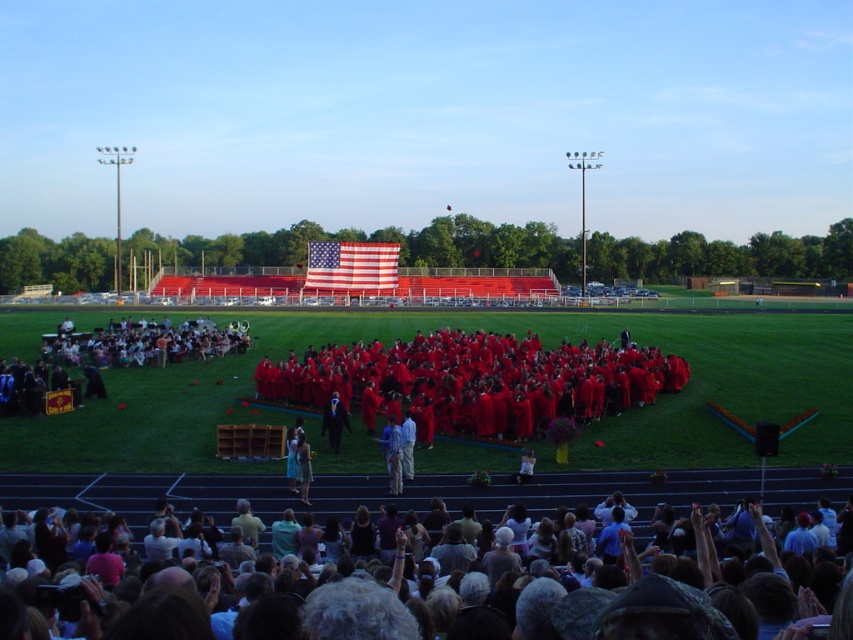
From the picture: You are a photographer trying to capture a clear photo of both the red matte graduation gowns at center and the dark blue suit at center. Which object should you focus on first to ensure it appears sharp in the photo?

The red matte graduation gowns at center is much taller than the dark blue suit at center, so you should focus on the red matte graduation gowns at center first to ensure it appears sharp in the photo.

You are a photographer at the graduation ceremony. You want to take a photo that includes both the matte red graduation gowns at lower center and the dark blue suit at center. Given their sizes, which object should you focus on to ensure both are in frame without zooming in or out?

The matte red graduation gowns at lower center are larger in size compared to the dark blue suit at center. To include both in the frame without zooming, focus on the larger object, the matte red graduation gowns at lower center, as it will occupy more space and allow the smaller dark blue suit at center to fit within the same view.